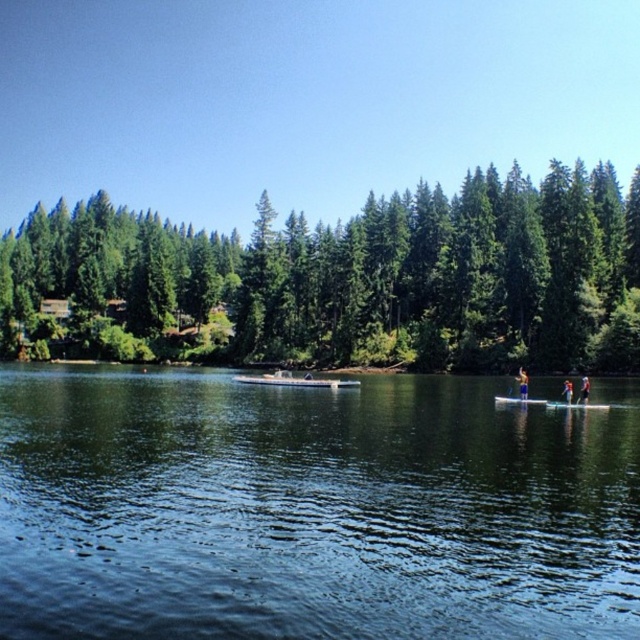
Is green matte trees at center behind smooth white surfboard at center?

Yes.

Does green matte trees at center appear on the right side of smooth white surfboard at center?

Incorrect, green matte trees at center is not on the right side of smooth white surfboard at center.

Find the location of a particular element. The height and width of the screenshot is (640, 640). green matte trees at center is located at coordinates (346, 280).

The width and height of the screenshot is (640, 640). Describe the element at coordinates (296, 380) in the screenshot. I see `white matte boat at center` at that location.

Does white matte boat at center have a lesser height compared to smooth white surfboard at center?

Correct, white matte boat at center is not as tall as smooth white surfboard at center.

Is point (244, 376) less distant than point (584, 397)?

No, it is behind (584, 397).

You are a GUI agent. You are given a task and a screenshot of the screen. Output one action in this format:
    pyautogui.click(x=<x>, y=<y>)
    Task: Click on the white matte boat at center
    
    Given the screenshot: What is the action you would take?
    pyautogui.click(x=296, y=380)

Can you confirm if yellow fabric paddleboard at center is positioned to the left of blue fabric surfboard at center?

Indeed, yellow fabric paddleboard at center is positioned on the left side of blue fabric surfboard at center.

Who is more forward, (525, 378) or (564, 394)?

Positioned in front is point (564, 394).

This screenshot has height=640, width=640. Find the location of `yellow fabric paddleboard at center`. yellow fabric paddleboard at center is located at coordinates (522, 384).